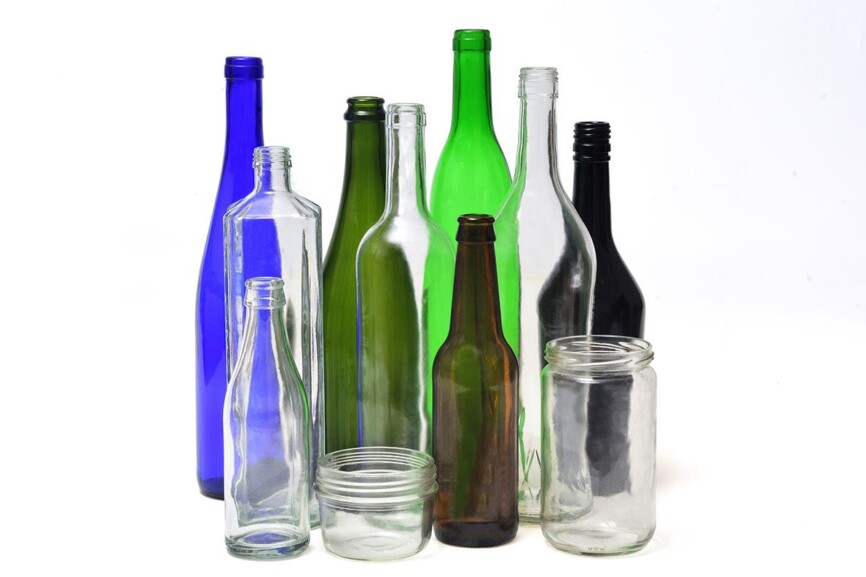
Image resolution: width=866 pixels, height=577 pixels. Find the location of `colored glass`. colored glass is located at coordinates (359, 186), (250, 119), (470, 156), (477, 287), (590, 207).